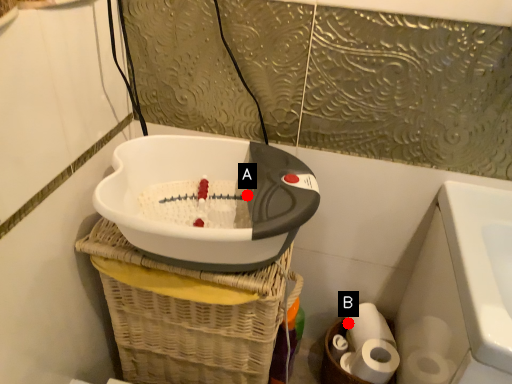
Question: Two points are circled on the image, labeled by A and B beside each circle. Which point appears farthest from the camera in this image?

Choices:
 (A) A is further
 (B) B is further

Answer: (B)